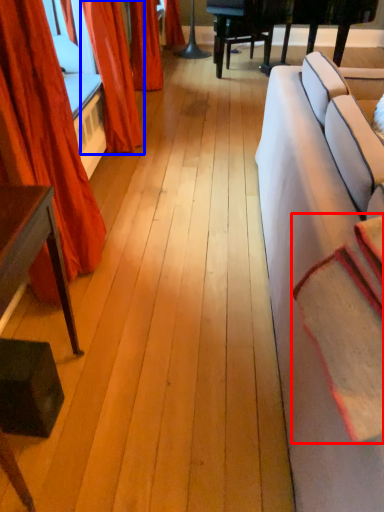
Question: Which object appears closest to the camera in this image, blanket (highlighted by a red box) or curtain (highlighted by a blue box)?

Choices:
 (A) blanket
 (B) curtain

Answer: (A)